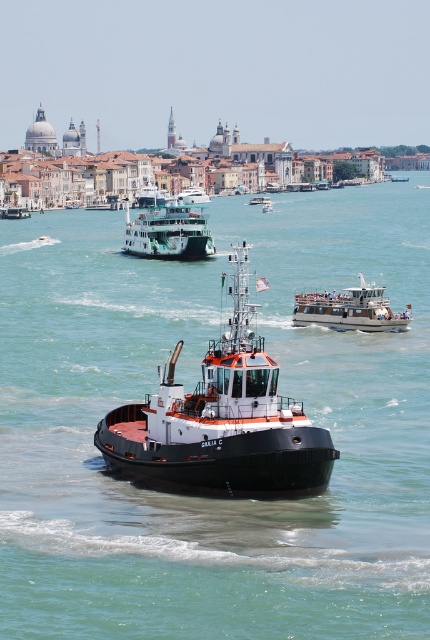
From the picture: You are a tourist on a boat tour in Venice. You see the black rubber tugboat at center and the green matte ferry at center. Which one is positioned to the right side of the other?

The black rubber tugboat at center is positioned to the right of the green matte ferry at center.

You are a photographer standing on the dock and want to take a photo of both the clear blue water at center and the green matte ferry at center. Which object will appear larger in the photo?

The clear blue water at center will appear larger in the photo because it is closer to the viewer than the green matte ferry at center.

You are standing on the deck of the tugboat Giulia C in the image. There is a point at coordinates [169,611] that you need to reach. Can you determine if this point is within a 40 meter radius from your current position?

The point at coordinates [169,611] is 38.74 meters away from the viewer, so yes, it is within a 40 meter radius.